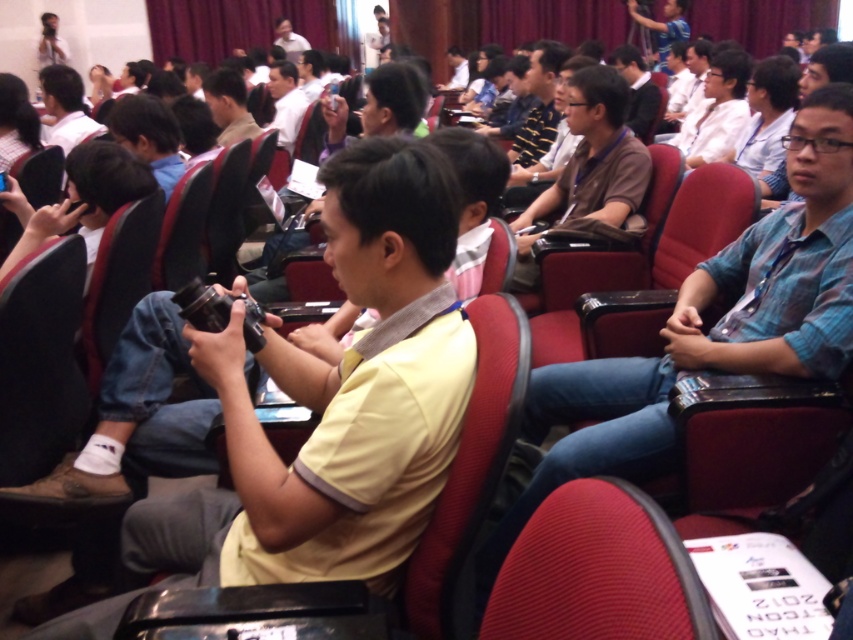
Is red fabric chair at lower center shorter than matte white shirt at center?

Yes.

Image resolution: width=853 pixels, height=640 pixels. Describe the element at coordinates (596, 572) in the screenshot. I see `red fabric chair at lower center` at that location.

Where is `red fabric chair at lower center`? The width and height of the screenshot is (853, 640). red fabric chair at lower center is located at coordinates (596, 572).

Does red fabric chair at lower center have a greater height compared to dark blue shirt at center?

In fact, red fabric chair at lower center may be shorter than dark blue shirt at center.

Locate an element on the screen. The width and height of the screenshot is (853, 640). red fabric chair at lower center is located at coordinates (596, 572).

Identify the location of red fabric chair at lower center. (596, 572).

Is matte black camera at upper left shorter than matte white shirt at center?

Indeed, matte black camera at upper left has a lesser height compared to matte white shirt at center.

How far apart are matte black camera at upper left and matte white shirt at center?

A distance of 5.27 feet exists between matte black camera at upper left and matte white shirt at center.

Image resolution: width=853 pixels, height=640 pixels. I want to click on matte black camera at upper left, so click(65, 106).

This screenshot has width=853, height=640. I want to click on matte black camera at upper left, so click(65, 106).